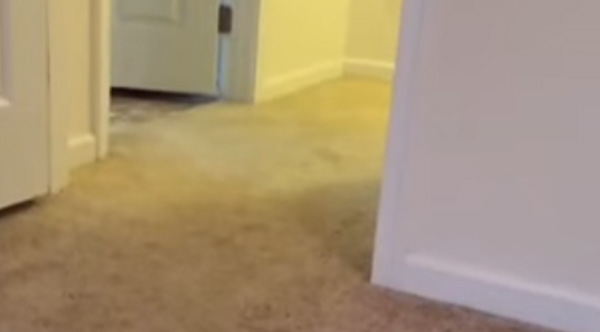
Find the location of a particular element. floor is located at coordinates (141, 107).